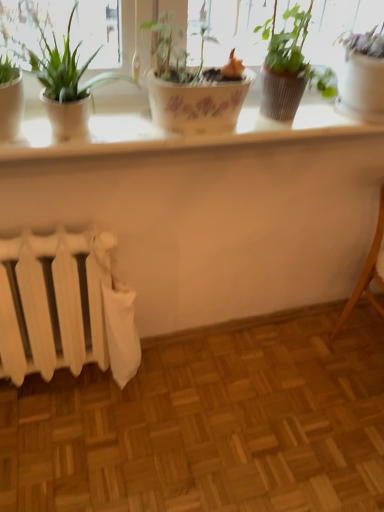
This screenshot has height=512, width=384. I want to click on vacant space in white glossy counter top at upper center (from a real-world perspective), so click(x=219, y=347).